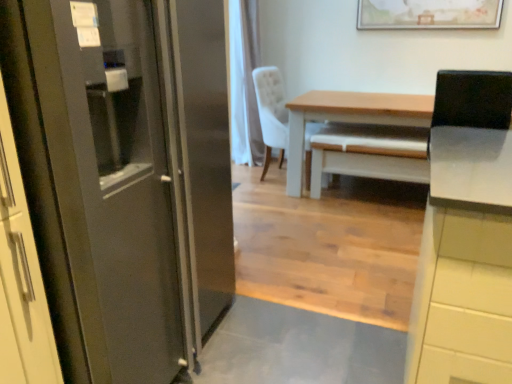
Image resolution: width=512 pixels, height=384 pixels. I want to click on white glossy cabinet at upper right, so click(x=464, y=262).

Describe the element at coordinates (271, 112) in the screenshot. I see `white fabric chair at center` at that location.

Find the location of `wooden framed artwork at upper center`. wooden framed artwork at upper center is located at coordinates (429, 14).

Locate an element on the screen. The image size is (512, 384). satin metallic refrigerator at left is located at coordinates (105, 191).

Can you tell me how much wooden framed artwork at upper center and light brown wooden table at center differ in facing direction?

The angular difference between wooden framed artwork at upper center and light brown wooden table at center is 0.139 degrees.

Would you say wooden framed artwork at upper center is to the left or to the right of light brown wooden table at center in the picture?

wooden framed artwork at upper center is positioned on light brown wooden table at center's right side.

In the scene shown: Is wooden framed artwork at upper center far away from light brown wooden table at center?

No, wooden framed artwork at upper center is not far away from light brown wooden table at center.

At what (x,y) coordinates should I click in order to perform the action: click on picture frame behind the light brown wooden table at center. Please return your answer as a coordinate pair (x, y). The height and width of the screenshot is (384, 512). Looking at the image, I should click on (429, 14).

Do you think white glossy cabinet at upper right is within white fabric chair at center, or outside of it?

white glossy cabinet at upper right is outside white fabric chair at center.

From the image's perspective, is white glossy cabinet at upper right beneath white fabric chair at center?

Correct, white glossy cabinet at upper right appears lower than white fabric chair at center in the image.

Which of these two, white glossy cabinet at upper right or white fabric chair at center, stands taller?

With more height is white glossy cabinet at upper right.

Is the depth of white glossy cabinet at upper right greater than that of white fabric chair at center?

No, it is not.

In the image, there is a satin metallic refrigerator at left. Find the location of `table above it (from the image's perspective)`. table above it (from the image's perspective) is located at coordinates (348, 119).

Does point (323, 107) come in front of point (157, 222)?

No, it is not.

Is light brown wooden table at center bigger or smaller than satin metallic refrigerator at left?

Considering their sizes, light brown wooden table at center takes up more space than satin metallic refrigerator at left.

Between light brown wooden table at center and satin metallic refrigerator at left, which one appears on the left side from the viewer's perspective?

satin metallic refrigerator at left is more to the left.

Is light brown wooden table at center outside of wooden framed artwork at upper center?

Yes, light brown wooden table at center is outside of wooden framed artwork at upper center.

Does light brown wooden table at center touch wooden framed artwork at upper center?

light brown wooden table at center and wooden framed artwork at upper center are clearly separated.

From the image's perspective, which object appears higher, light brown wooden table at center or wooden framed artwork at upper center?

wooden framed artwork at upper center, from the image's perspective.

Looking at this image, is light brown wooden table at center oriented towards wooden framed artwork at upper center?

No, light brown wooden table at center does not turn towards wooden framed artwork at upper center.

Is satin metallic refrigerator at left located outside light brown wooden table at center?

Absolutely, satin metallic refrigerator at left is external to light brown wooden table at center.

Is satin metallic refrigerator at left oriented towards light brown wooden table at center?

No, satin metallic refrigerator at left is not oriented towards light brown wooden table at center.

Considering the relative positions of satin metallic refrigerator at left and light brown wooden table at center in the image provided, is satin metallic refrigerator at left to the right of light brown wooden table at center from the viewer's perspective?

No, satin metallic refrigerator at left is not to the right of light brown wooden table at center.

From a real-world perspective, is satin metallic refrigerator at left physically located above or below light brown wooden table at center?

satin metallic refrigerator at left is above light brown wooden table at center.

Considering the sizes of objects light brown wooden table at center and white glossy cabinet at upper right in the image provided, who is thinner, light brown wooden table at center or white glossy cabinet at upper right?

white glossy cabinet at upper right.

Does light brown wooden table at center have a greater height compared to white glossy cabinet at upper right?

Incorrect, the height of light brown wooden table at center is not larger of that of white glossy cabinet at upper right.

How many degrees apart are the facing directions of light brown wooden table at center and white glossy cabinet at upper right?

The angle between the facing direction of light brown wooden table at center and the facing direction of white glossy cabinet at upper right is 3.75 degrees.

From the image's perspective, relative to white glossy cabinet at upper right, is light brown wooden table at center above or below?

light brown wooden table at center is above white glossy cabinet at upper right.

Is satin metallic refrigerator at left situated inside white fabric chair at center or outside?

satin metallic refrigerator at left is not enclosed by white fabric chair at center.

From a real-world perspective, which object rests below the other?

From a 3D spatial view, white fabric chair at center is below.

Based on the photo, is there a large distance between satin metallic refrigerator at left and white fabric chair at center?

satin metallic refrigerator at left is far away from white fabric chair at center.

Between satin metallic refrigerator at left and white fabric chair at center, which one has smaller size?

white fabric chair at center is smaller.

Locate an element on the screen. This screenshot has width=512, height=384. table to the left of wooden framed artwork at upper center is located at coordinates (348, 119).

Locate an element on the screen. The image size is (512, 384). cabinetry that is above the white fabric chair at center (from a real-world perspective) is located at coordinates (464, 262).

From the image, which object appears to be farther from wooden framed artwork at upper center, white fabric chair at center or satin metallic refrigerator at left?

satin metallic refrigerator at left lies further to wooden framed artwork at upper center than the other object.

From the image, which object appears to be farther from satin metallic refrigerator at left, light brown wooden table at center or white glossy cabinet at upper right?

Based on the image, light brown wooden table at center appears to be further to satin metallic refrigerator at left.

Based on their spatial positions, is white glossy cabinet at upper right or white fabric chair at center closer to satin metallic refrigerator at left?

white glossy cabinet at upper right is closer to satin metallic refrigerator at left.

From the image, which object appears to be nearer to light brown wooden table at center, white fabric chair at center or wooden framed artwork at upper center?

Based on the image, white fabric chair at center appears to be nearer to light brown wooden table at center.

Estimate the real-world distances between objects in this image. Which object is closer to light brown wooden table at center, white fabric chair at center or white glossy cabinet at upper right?

white fabric chair at center is positioned closer to the anchor light brown wooden table at center.

From the picture: Which object lies further to the anchor point white glossy cabinet at upper right, white fabric chair at center or wooden framed artwork at upper center?

wooden framed artwork at upper center.

From the image, which object appears to be farther from white fabric chair at center, wooden framed artwork at upper center or satin metallic refrigerator at left?

satin metallic refrigerator at left.

Based on their spatial positions, is wooden framed artwork at upper center or light brown wooden table at center further from white fabric chair at center?

wooden framed artwork at upper center lies further to white fabric chair at center than the other object.

Where is `cabinetry between satin metallic refrigerator at left and wooden framed artwork at upper center from front to back`? This screenshot has width=512, height=384. cabinetry between satin metallic refrigerator at left and wooden framed artwork at upper center from front to back is located at coordinates (464, 262).

At what (x,y) coordinates should I click in order to perform the action: click on table located between satin metallic refrigerator at left and white fabric chair at center in the depth direction. Please return your answer as a coordinate pair (x, y). Image resolution: width=512 pixels, height=384 pixels. Looking at the image, I should click on (348, 119).

The height and width of the screenshot is (384, 512). In order to click on chair between satin metallic refrigerator at left and wooden framed artwork at upper center along the z-axis in this screenshot , I will do `click(271, 112)`.

Locate an element on the screen. This screenshot has width=512, height=384. table between white glossy cabinet at upper right and white fabric chair at center in the front-back direction is located at coordinates (348, 119).